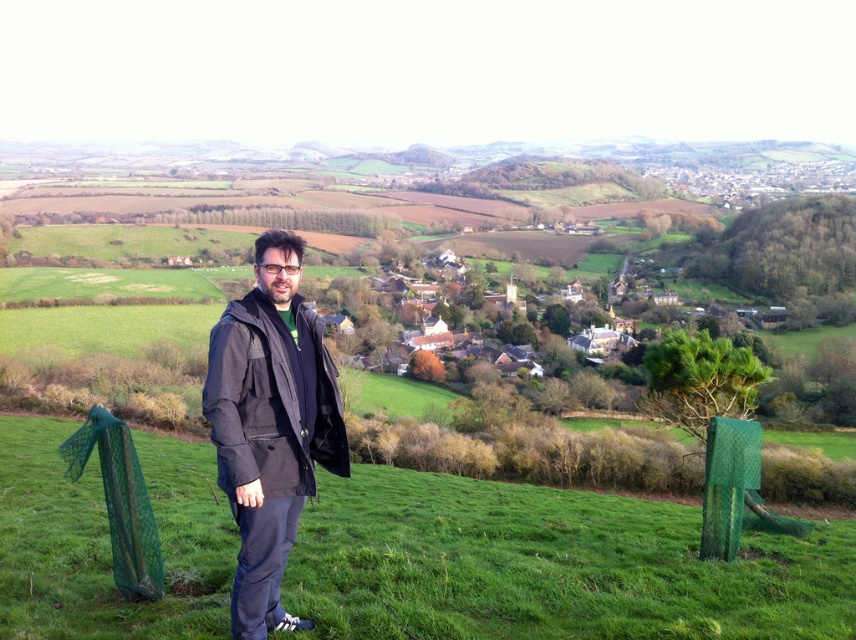
Does green grassy at center have a lesser height compared to dark gray fabric jacket at center?

Yes.

Is green grassy at center further to camera compared to dark gray fabric jacket at center?

Yes, green grassy at center is further from the viewer.

Locate an element on the screen. The width and height of the screenshot is (856, 640). green grassy at center is located at coordinates (548, 564).